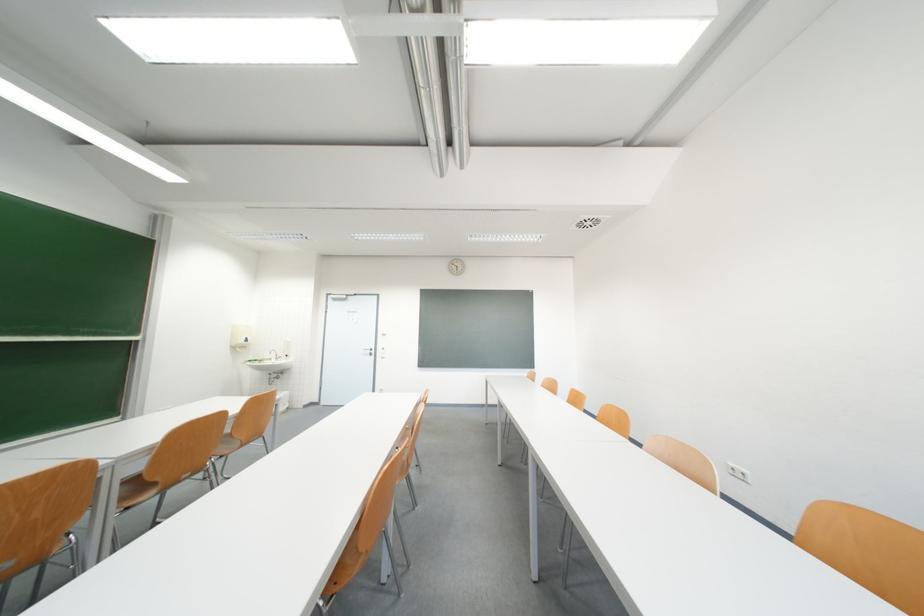
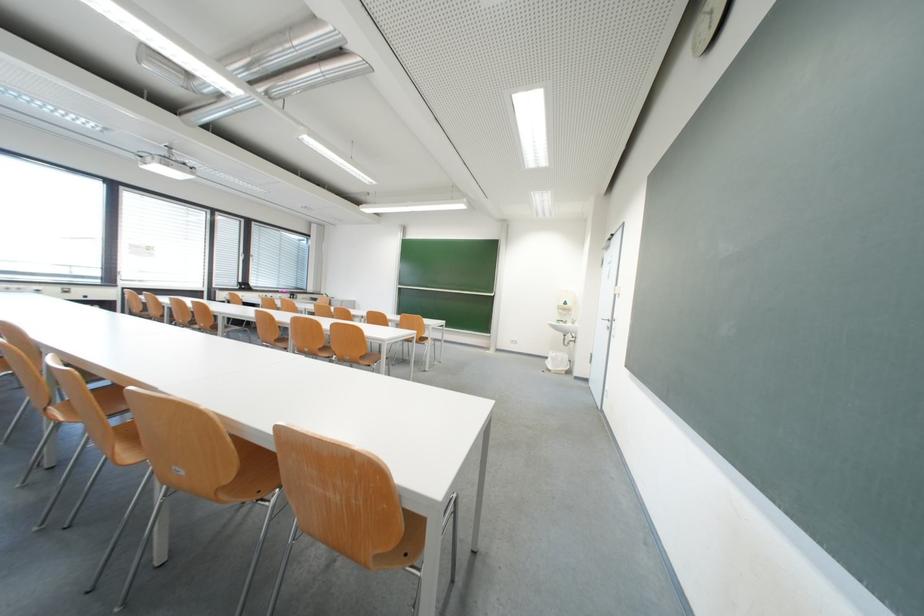
Find the pixel in the second image that matches pixel 265 365 in the first image.

(570, 326)